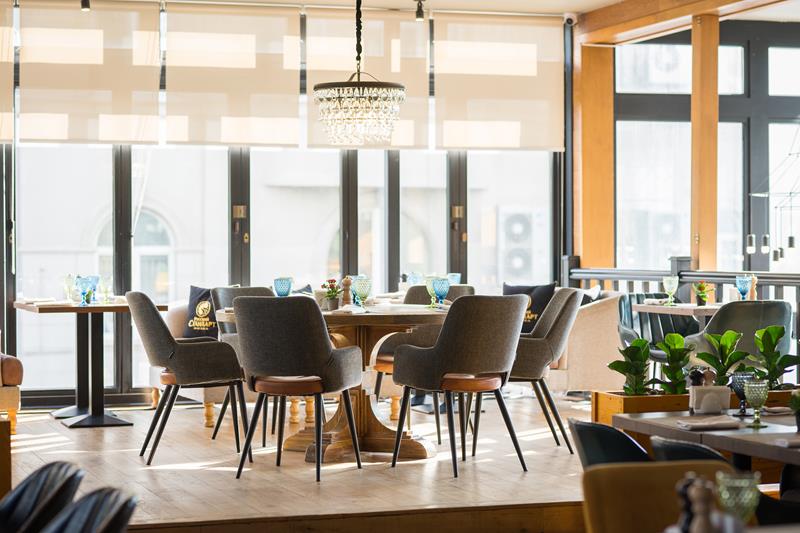
Locate an element on the screen. This screenshot has width=800, height=533. shades is located at coordinates (6, 114), (73, 92), (217, 88), (332, 56), (497, 54).